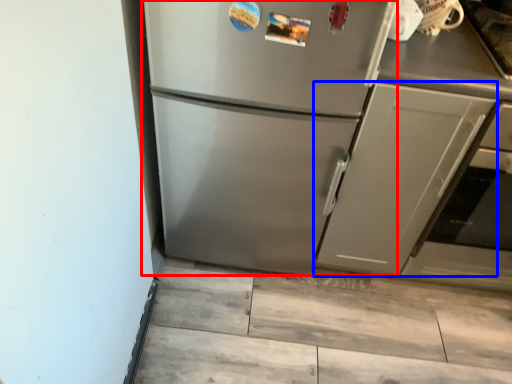
Question: Which of the following is the closest to the observer, refrigerator (highlighted by a red box) or cabinetry (highlighted by a blue box)?

Choices:
 (A) refrigerator
 (B) cabinetry

Answer: (A)